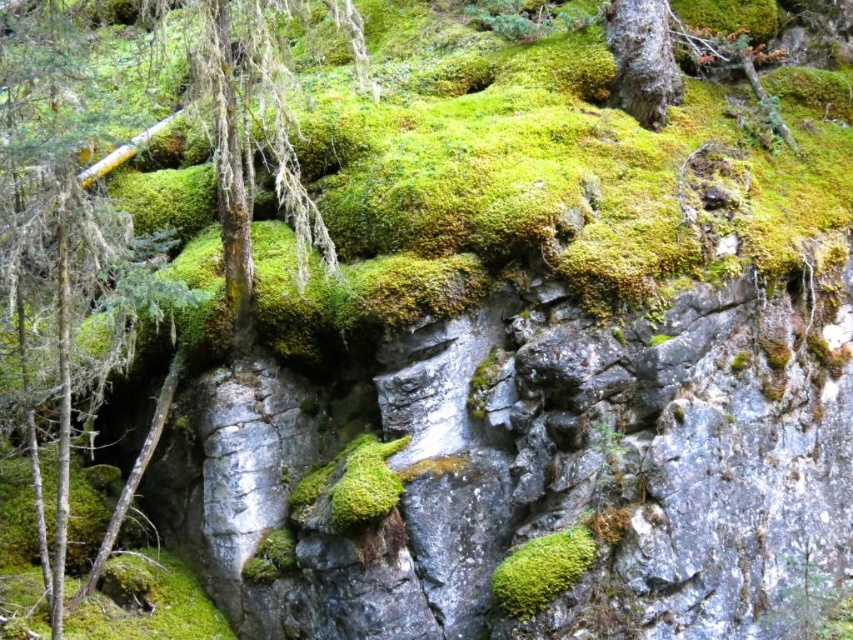
Does green mossy tree at upper left appear under green mossy bark at upper right?

Indeed, green mossy tree at upper left is positioned under green mossy bark at upper right.

How much distance is there between green mossy tree at upper left and green mossy bark at upper right?

green mossy tree at upper left is 1.70 meters away from green mossy bark at upper right.

Does point (9, 48) come closer to viewer compared to point (618, 88)?

Yes, point (9, 48) is closer to viewer.

Identify the location of green mossy tree at upper left. The image size is (853, 640). (44, 205).